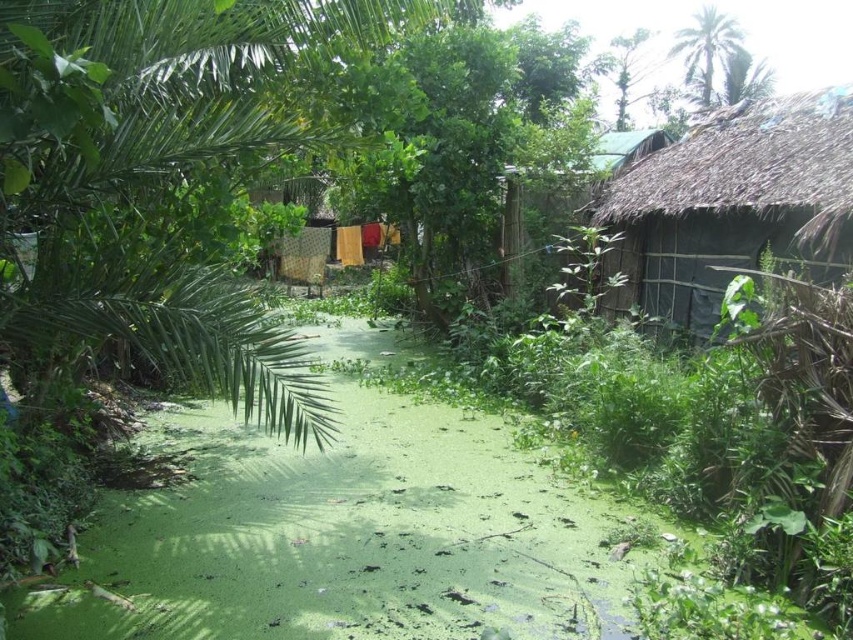
Question: Does thatched roof hut at right appear on the right side of green thatched hut at upper right?

Choices:
 (A) no
 (B) yes

Answer: (B)

Question: Observing the image, what is the correct spatial positioning of thatched roof hut at right in reference to green thatched hut at upper right?

Choices:
 (A) above
 (B) below

Answer: (B)

Question: Observing the image, what is the correct spatial positioning of thatched roof hut at right in reference to green thatched hut at upper right?

Choices:
 (A) below
 (B) above

Answer: (A)

Question: Which point is farther to the camera?

Choices:
 (A) (595, 182)
 (B) (740, 161)

Answer: (A)